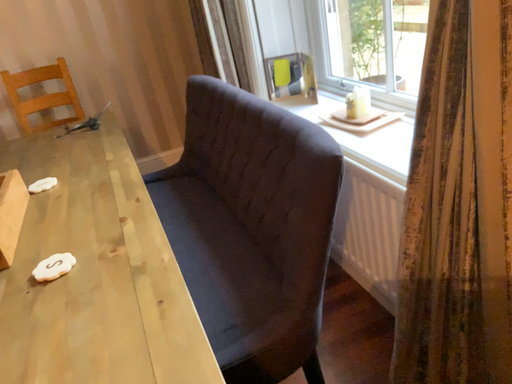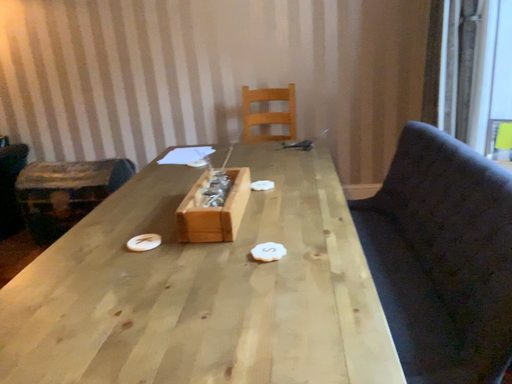
Question: Which way did the camera rotate in the video?

Choices:
 (A) rotated upward
 (B) rotated downward

Answer: (A)